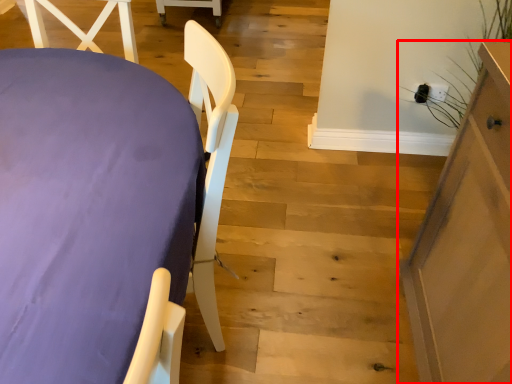
Question: From the image's perspective, what is the correct spatial relationship of furniture (annotated by the red box) in relation to furniture?

Choices:
 (A) above
 (B) below

Answer: (B)